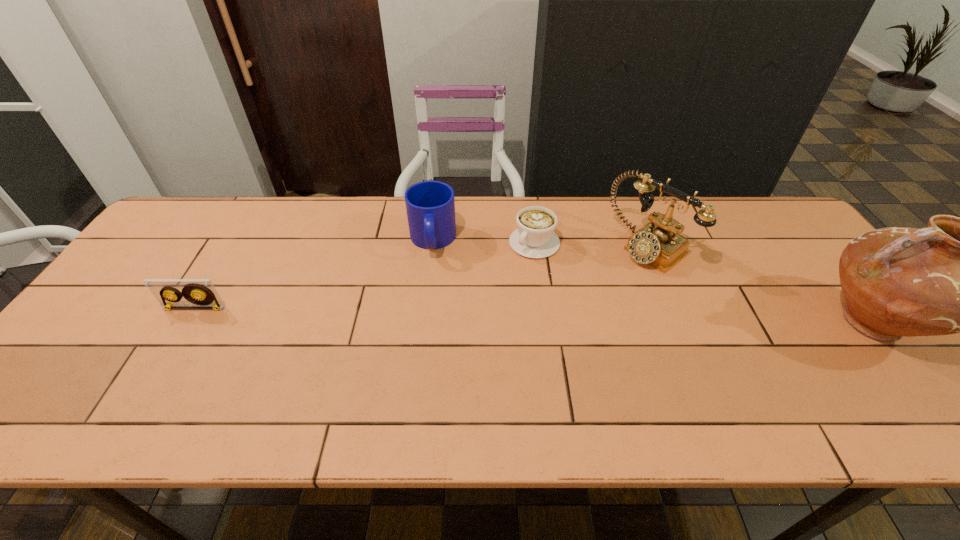
This screenshot has width=960, height=540. Find the location of `free space on the desktop that is between the leftmost object and the rightmost object and is positioned to the right of the cappuccino's handle`. free space on the desktop that is between the leftmost object and the rightmost object and is positioned to the right of the cappuccino's handle is located at coordinates (470, 314).

This screenshot has height=540, width=960. I want to click on vacant spot on the desktop that is between the videotape and the tallest object and is positioned on the side with the handle of the mug, so click(x=430, y=313).

Where is `free spot on the desktop that is between the leftmost object and the pottery and is positioned on the dial number of the telephone`? This screenshot has width=960, height=540. free spot on the desktop that is between the leftmost object and the pottery and is positioned on the dial number of the telephone is located at coordinates (550, 316).